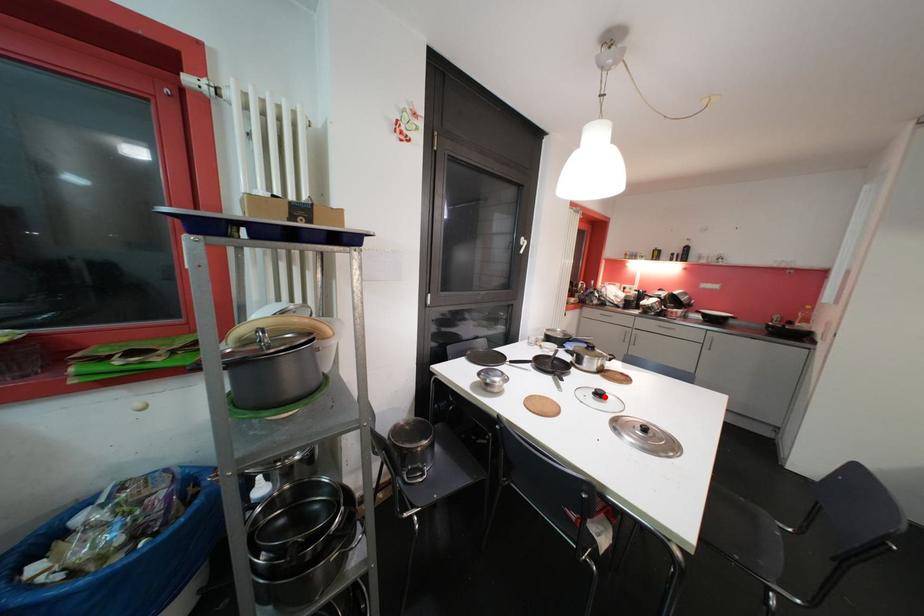
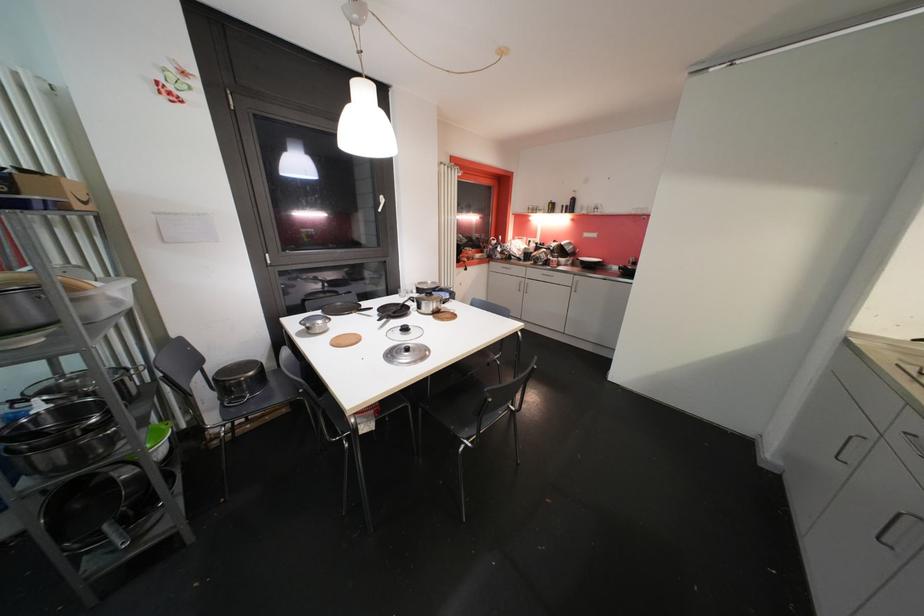
Locate, in the second image, the point that corresponds to the highlighted location in the first image.

(409, 331)